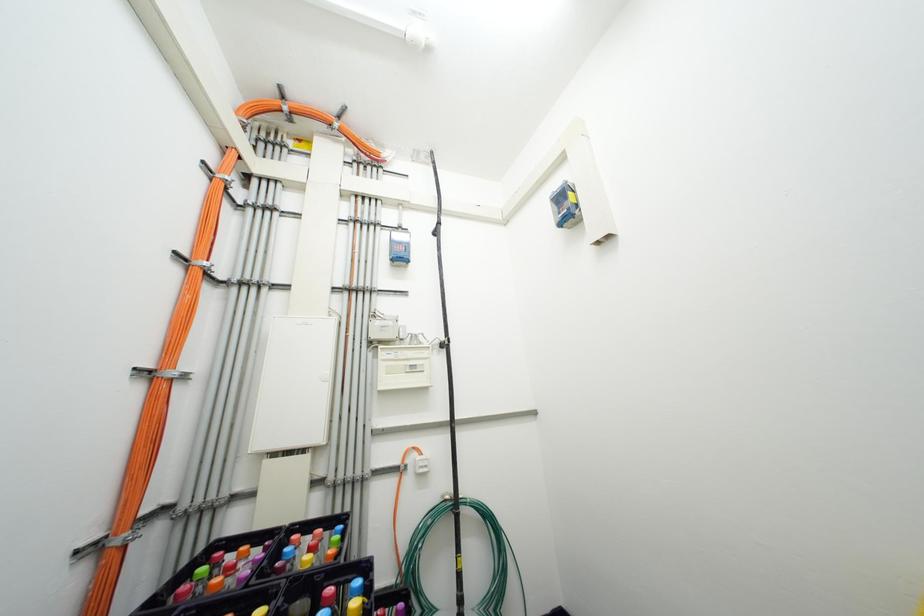
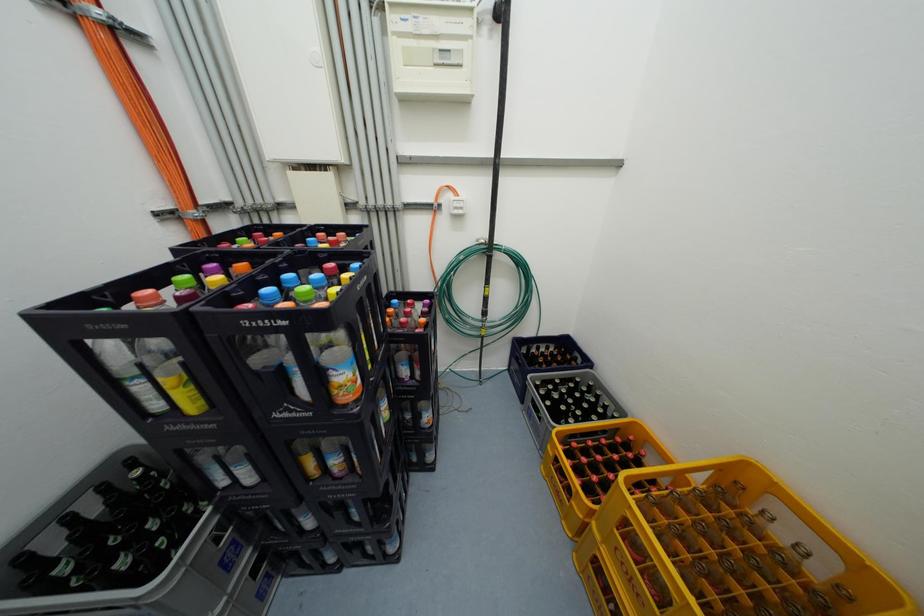
The first image is from the beginning of the video and the second image is from the end. How did the camera likely rotate when shooting the video?

Result: The camera rotated toward left-down.